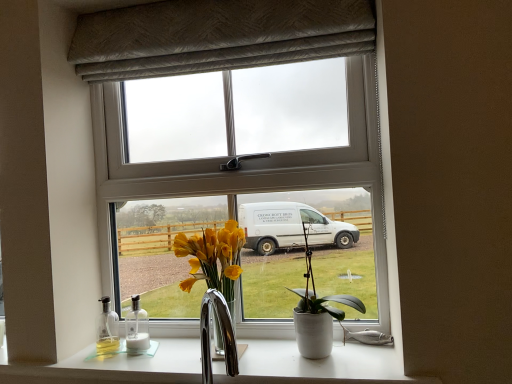
Identify the location of spots to the right of white glossy bottle at lower left. (183, 347).